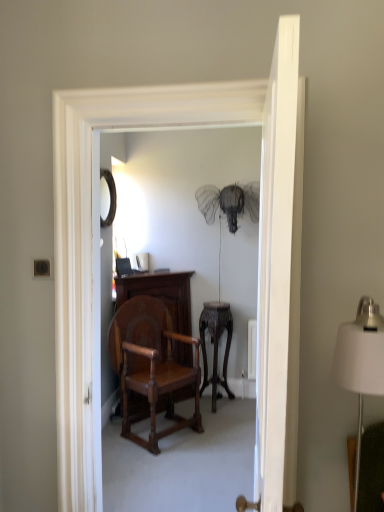
The width and height of the screenshot is (384, 512). Identify the location of free space in front of polished wood chair at center. (166, 466).